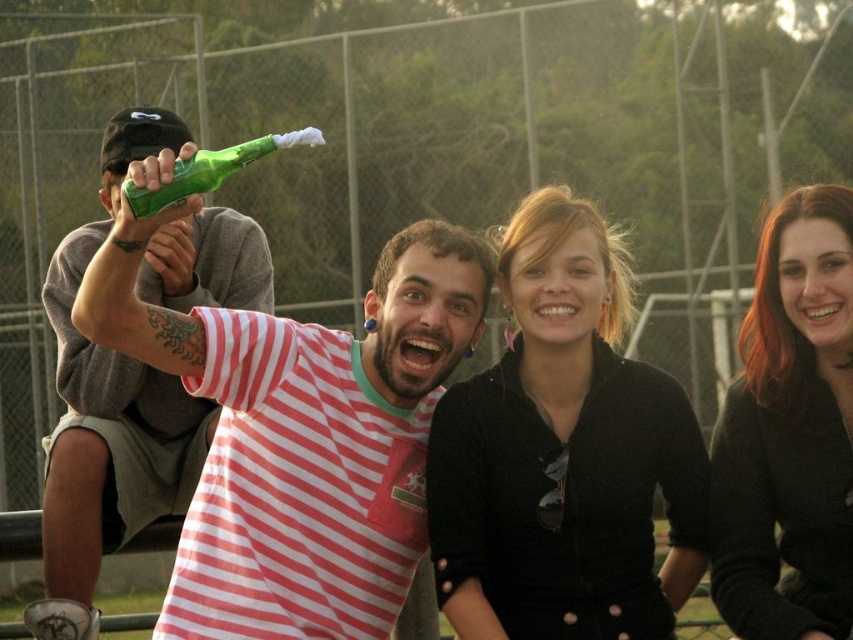
Question: Is striped cotton shirt at center thinner than green glass bottle at upper left?

Choices:
 (A) no
 (B) yes

Answer: (A)

Question: Which object is positioned closest to the black matte jacket at center?

Choices:
 (A) striped cotton shirt at center
 (B) smooth black sweater at right
 (C) green glass bottle at upper left

Answer: (A)

Question: Which object appears closest to the camera in this image?

Choices:
 (A) green glass bottle at upper left
 (B) striped cotton shirt at center

Answer: (B)

Question: Is smooth black sweater at right wider than green matte bottle at left?

Choices:
 (A) no
 (B) yes

Answer: (A)

Question: Is black matte jacket at center below smooth black sweater at right?

Choices:
 (A) yes
 (B) no

Answer: (A)

Question: Which of the following is the closest to the observer?

Choices:
 (A) smooth black sweater at right
 (B) green matte bottle at left
 (C) green glass bottle at upper left

Answer: (C)